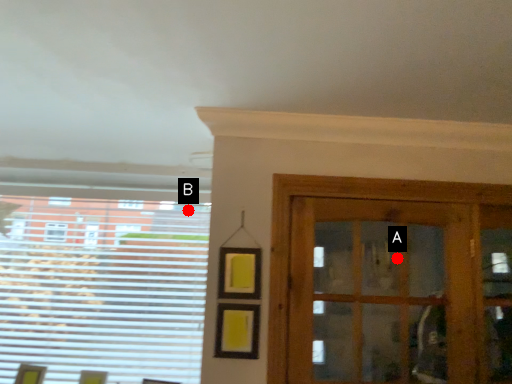
Question: Two points are circled on the image, labeled by A and B beside each circle. Which point is closer to the camera taking this photo?

Choices:
 (A) A is closer
 (B) B is closer

Answer: (B)